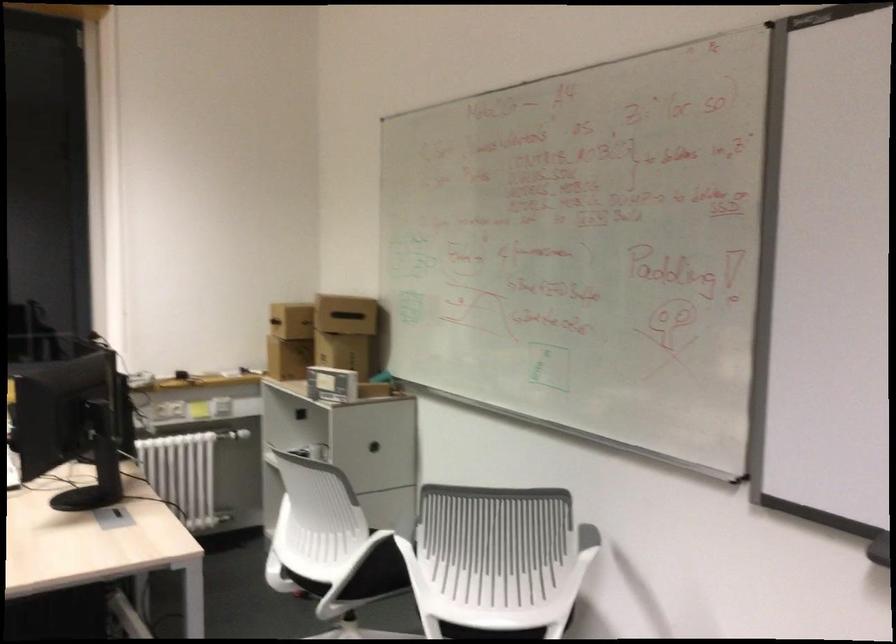
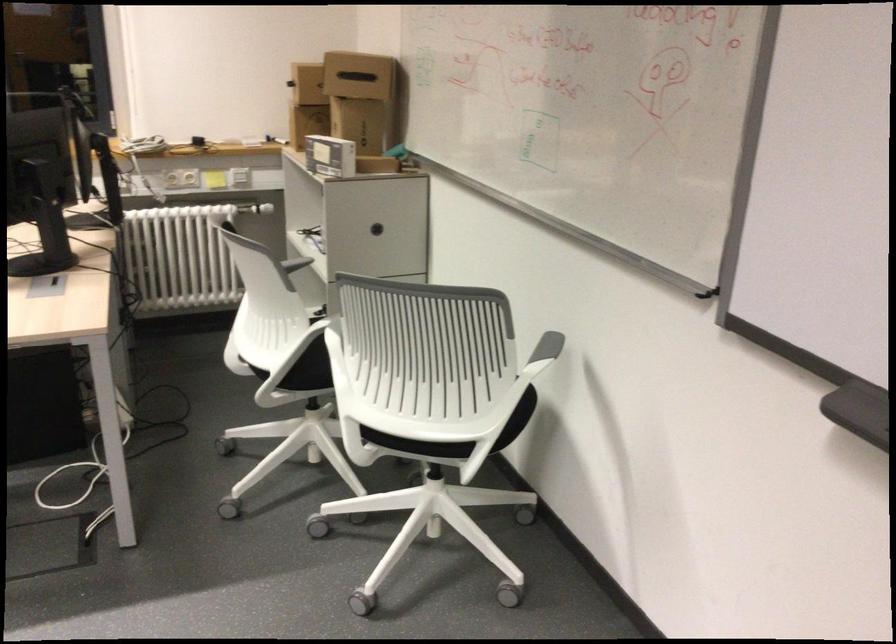
The point at (330, 383) is marked in the first image. Where is the corresponding point in the second image?

(330, 156)